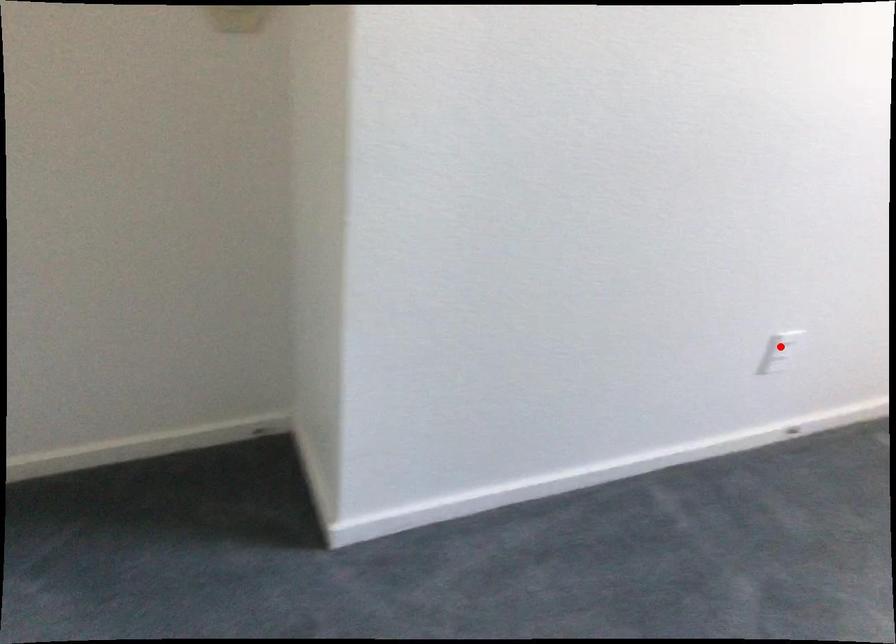
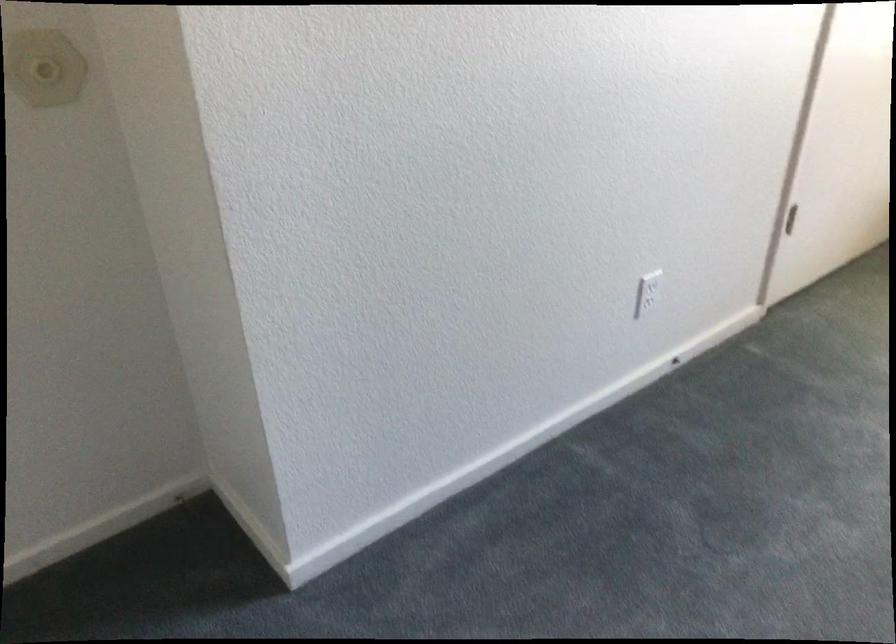
Where in the second image is the point corresponding to the highlighted location from the first image?

(650, 285)